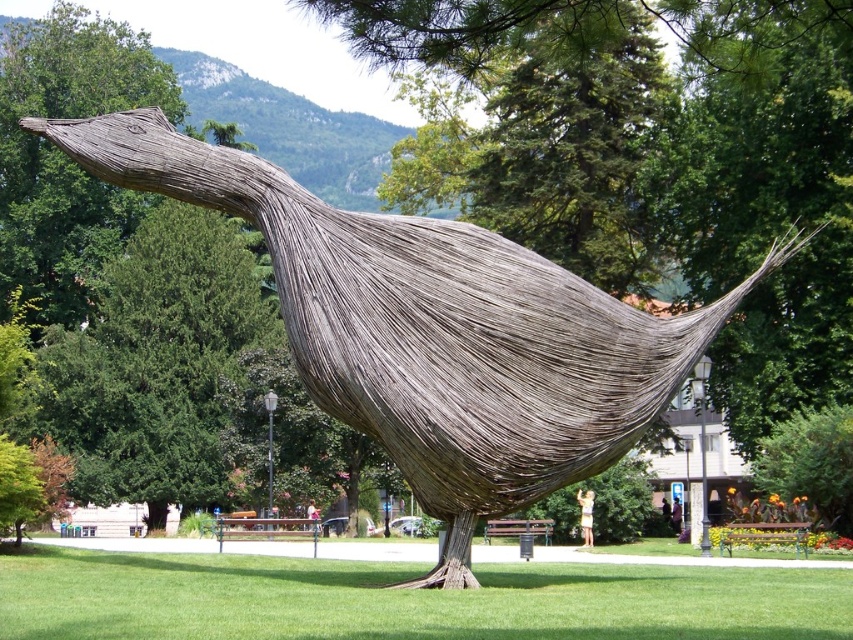
Looking at this image, does green grass at lower center have a lesser width compared to green textured tree at center?

Incorrect, green grass at lower center's width is not less than green textured tree at center's.

Which of these two, green grass at lower center or green textured tree at center, stands shorter?

With less height is green grass at lower center.

Where is `green grass at lower center`? green grass at lower center is located at coordinates (405, 600).

Find the location of a particular element. This screenshot has height=640, width=853. green grass at lower center is located at coordinates (405, 600).

How distant is natural wood bird at center from green textured tree at center?

natural wood bird at center is 34.92 meters from green textured tree at center.

Which is more to the left, natural wood bird at center or green textured tree at center?

green textured tree at center is more to the left.

Does point (450, 353) come closer to viewer compared to point (45, 358)?

That is True.

Image resolution: width=853 pixels, height=640 pixels. In order to click on natural wood bird at center in this screenshot , I will do `click(432, 330)`.

Who is taller, natural wood bird at center or green grass at lower center?

natural wood bird at center is taller.

Does natural wood bird at center have a lesser height compared to green grass at lower center?

Incorrect, natural wood bird at center's height does not fall short of green grass at lower center's.

Between point (560, 486) and point (93, 636), which one is positioned in front?

Point (93, 636) is in front.

Where is `natural wood bird at center`? The height and width of the screenshot is (640, 853). natural wood bird at center is located at coordinates (432, 330).